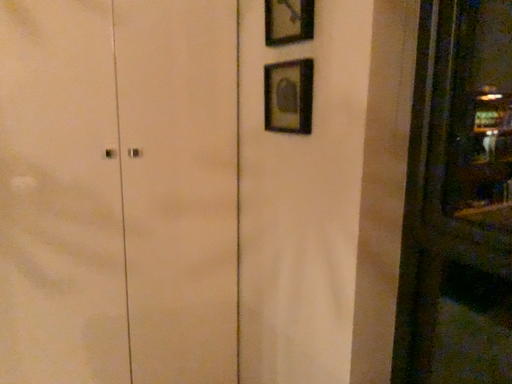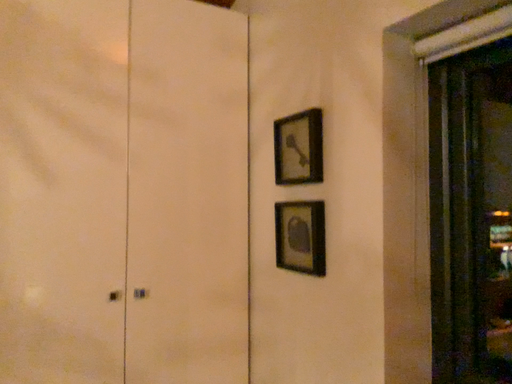
Question: How did the camera likely rotate when shooting the video?

Choices:
 (A) rotated downward
 (B) rotated upward

Answer: (B)